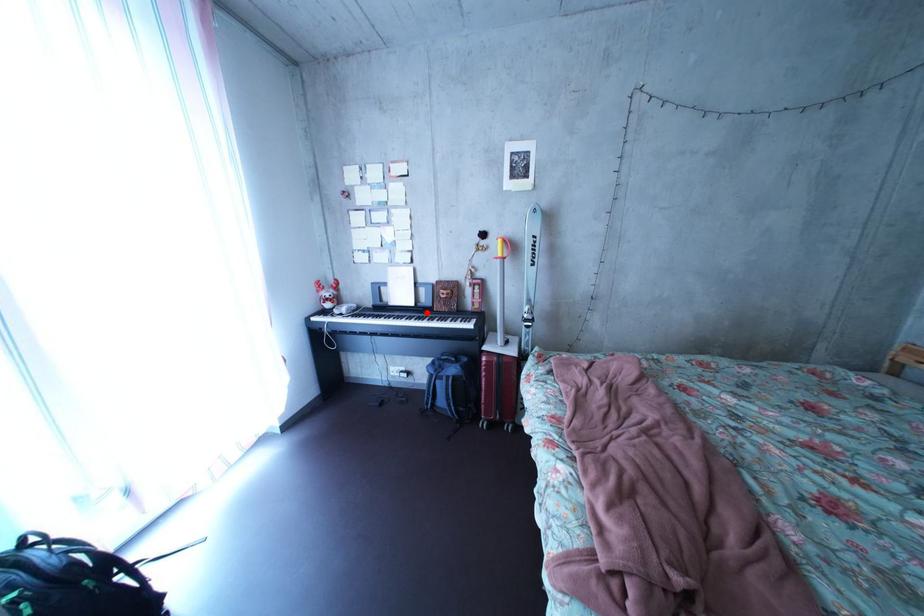
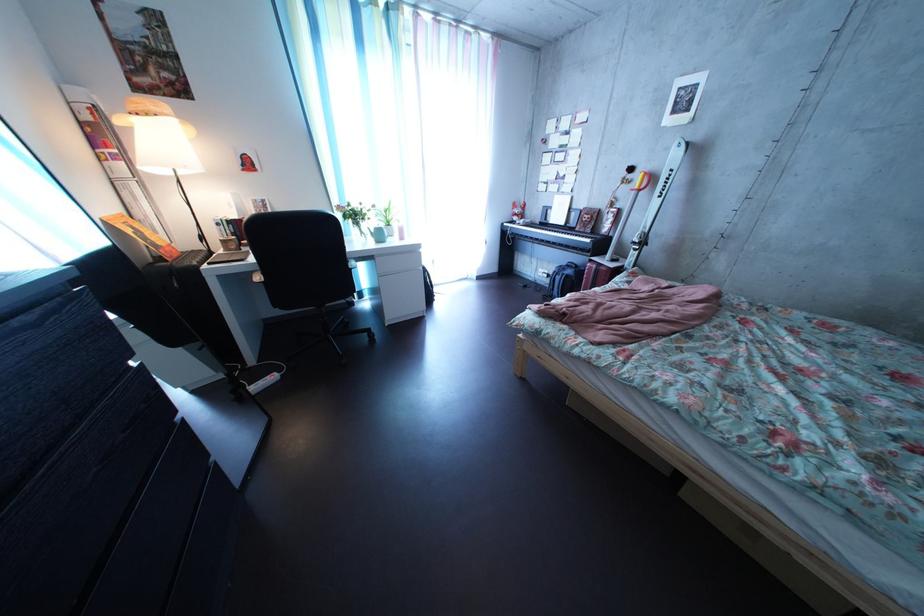
Question: I am providing you with two images of the same scene from different viewpoints. In image1, a red point is highlighted. Considering the same 3D point in image2, which of the following is correct?

Choices:
 (A) It is closer
 (B) It is farther

Answer: (A)